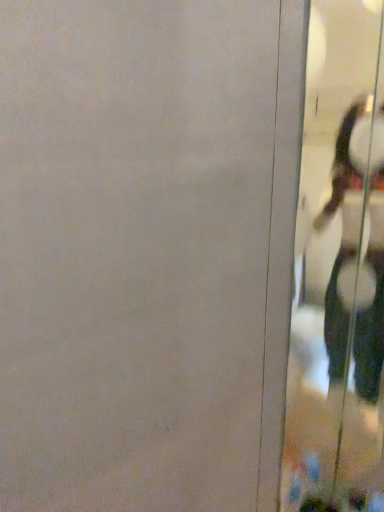
Question: Considering the relative positions of white glossy shoes at right and transparent glass screen door at right in the image provided, is white glossy shoes at right to the left or to the right of transparent glass screen door at right?

Choices:
 (A) right
 (B) left

Answer: (A)

Question: Considering the positions of point (357, 176) and point (296, 433), is point (357, 176) closer or farther from the camera than point (296, 433)?

Choices:
 (A) farther
 (B) closer

Answer: (B)

Question: Is white glossy shoes at right bigger or smaller than transparent glass screen door at right?

Choices:
 (A) small
 (B) big

Answer: (A)

Question: Is transparent glass screen door at right to the left or to the right of white glossy shoes at right in the image?

Choices:
 (A) left
 (B) right

Answer: (A)

Question: Is point (364, 101) closer or farther from the camera than point (382, 325)?

Choices:
 (A) farther
 (B) closer

Answer: (B)

Question: Based on their sizes in the image, would you say transparent glass screen door at right is bigger or smaller than white glossy shoes at right?

Choices:
 (A) big
 (B) small

Answer: (A)

Question: Relative to white glossy shoes at right, is transparent glass screen door at right in front or behind?

Choices:
 (A) behind
 (B) front

Answer: (B)